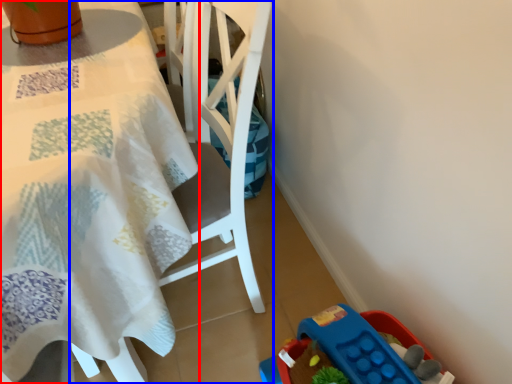
Question: Which of the following is the closest to the observer, table (highlighted by a red box) or chair (highlighted by a blue box)?

Choices:
 (A) table
 (B) chair

Answer: (A)